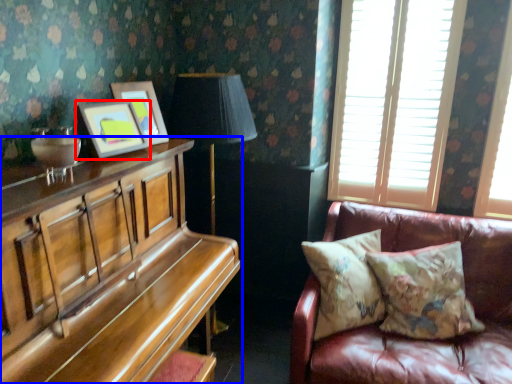
Question: Among these objects, which one is nearest to the camera, picture frame (highlighted by a red box) or piano (highlighted by a blue box)?

Choices:
 (A) picture frame
 (B) piano

Answer: (B)